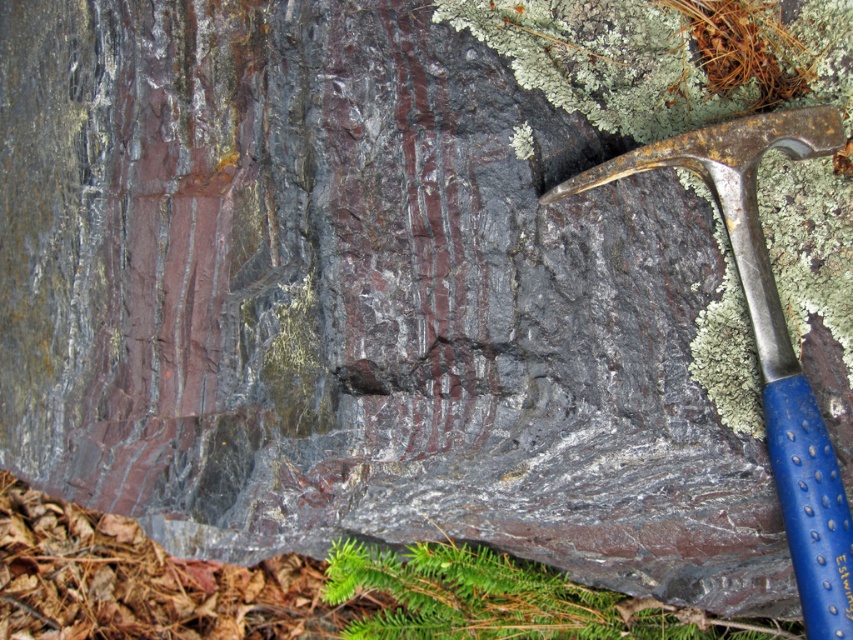
Which is behind, point (763, 353) or point (837, 563)?

Positioned behind is point (763, 353).

Describe the element at coordinates (769, 336) in the screenshot. The height and width of the screenshot is (640, 853). I see `blue plastic hammer at right` at that location.

Where is `blue plastic hammer at right`? The height and width of the screenshot is (640, 853). blue plastic hammer at right is located at coordinates (769, 336).